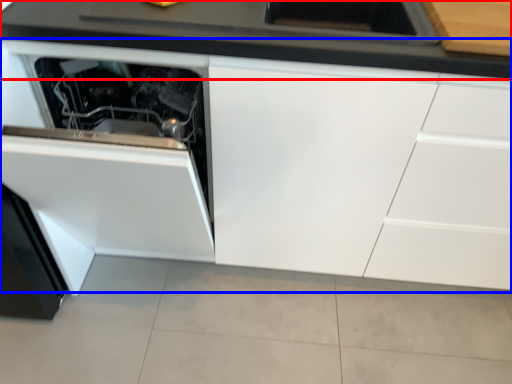
Question: Which of the following is the farthest to the observer, countertop (highlighted by a red box) or cabinetry (highlighted by a blue box)?

Choices:
 (A) countertop
 (B) cabinetry

Answer: (A)